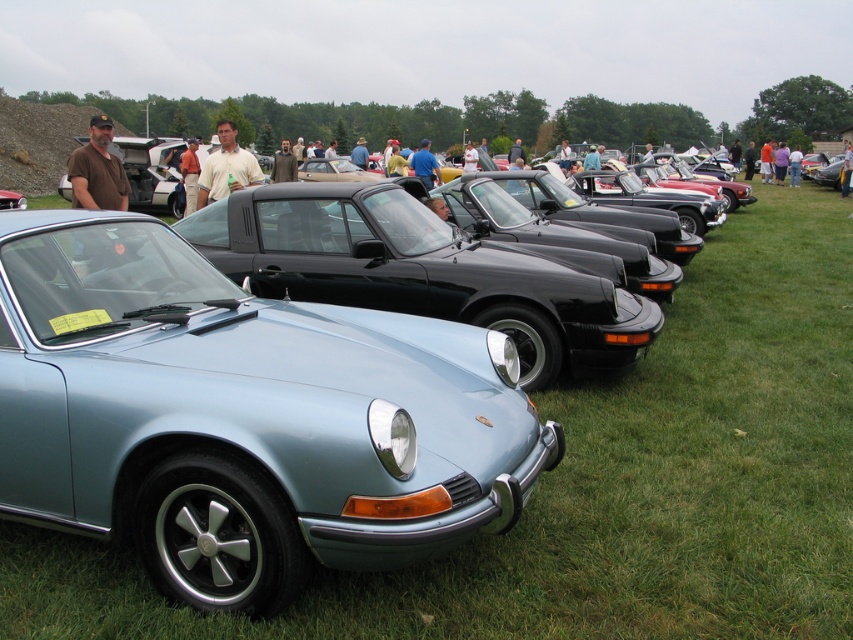
You are a photographer standing at the position of the camera. You want to take a photo of the brown cap at upper left. Can you reach the cap without moving the camera? The camera has a zoom lens with a maximum zoom range of 100 meters.

The brown cap at upper left and camera are 6.43 meters apart from each other. Since the camera has a maximum zoom range of 100 meters, you can zoom in to capture the brown cap at upper left without needing to move the camera.